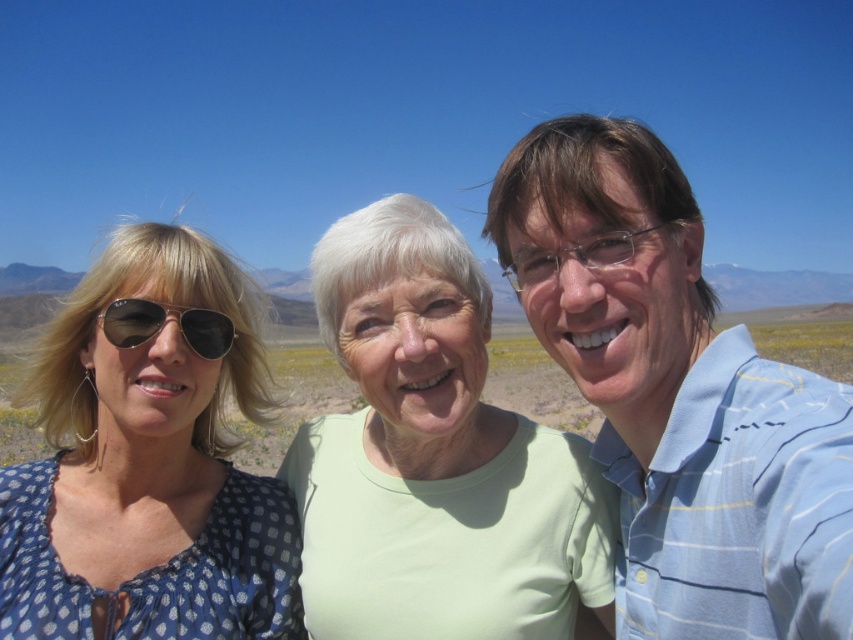
Is light green fabric at center bigger than blue dotted blouse at left?

Yes.

Between point (416, 205) and point (143, 572), which one is positioned behind?

The point (416, 205) is behind.

Where is `light green fabric at center`? This screenshot has width=853, height=640. light green fabric at center is located at coordinates pos(434,458).

Measure the distance between point (566, 204) and camera.

Point (566, 204) and camera are 21.66 feet apart.

The width and height of the screenshot is (853, 640). Identify the location of light blue striped shirt at right. (677, 394).

Looking at this image, measure the distance between point (666, 433) and camera.

Point (666, 433) and camera are 5.89 meters apart.

Which is behind, point (599, 388) or point (310, 588)?

Point (310, 588)

Between point (758, 605) and point (451, 518), which one is positioned behind?

The point (451, 518) is more distant.

The width and height of the screenshot is (853, 640). I want to click on light blue striped shirt at right, so click(677, 394).